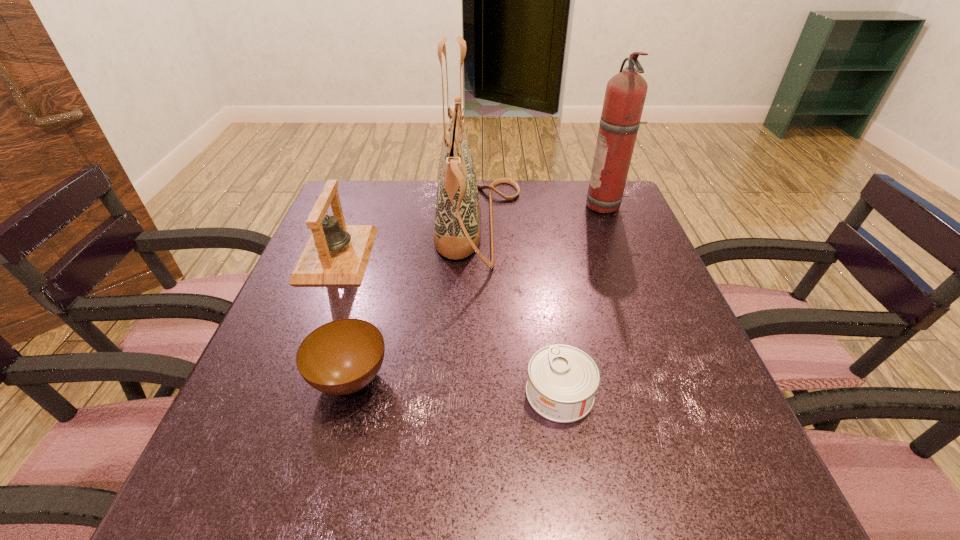
Locate an element on the screen. This screenshot has width=960, height=540. handbag is located at coordinates [x=457, y=233].

Locate an element on the screen. the rightmost object is located at coordinates (625, 94).

Locate an element on the screen. Image resolution: width=960 pixels, height=540 pixels. the third shortest object is located at coordinates (336, 253).

Locate an element on the screen. the fourth tallest object is located at coordinates (341, 357).

Image resolution: width=960 pixels, height=540 pixels. Find the location of `the shortest object`. the shortest object is located at coordinates (562, 381).

You are a GUI agent. You are given a task and a screenshot of the screen. Output one action in this format:
    pyautogui.click(x=<x>, y=<y>)
    Task: Click on the vacant space located on the front-facing side of the handbag
    
    Given the screenshot: What is the action you would take?
    pyautogui.click(x=585, y=226)

Identify the location of vacant space situated 0.170m on the side of the rightmost object with the label and nozzle. (525, 206).

Image resolution: width=960 pixels, height=540 pixels. I want to click on vacant area situated on the side of the rightmost object with the label and nozzle, so click(507, 206).

You are a GUI agent. You are given a task and a screenshot of the screen. Output one action in this format:
    pyautogui.click(x=<x>, y=<y>)
    Task: Click on the free space located 0.320m on the side of the rightmost object with the label and nozzle
    The height and width of the screenshot is (540, 960).
    Given the screenshot: What is the action you would take?
    click(471, 206)

You are a GUI agent. You are given a task and a screenshot of the screen. Output one action in this format:
    pyautogui.click(x=<x>, y=<y>)
    Task: Click on the vacant space located on the front of the third tallest object
    The width and height of the screenshot is (960, 540).
    Given the screenshot: What is the action you would take?
    tap(287, 380)